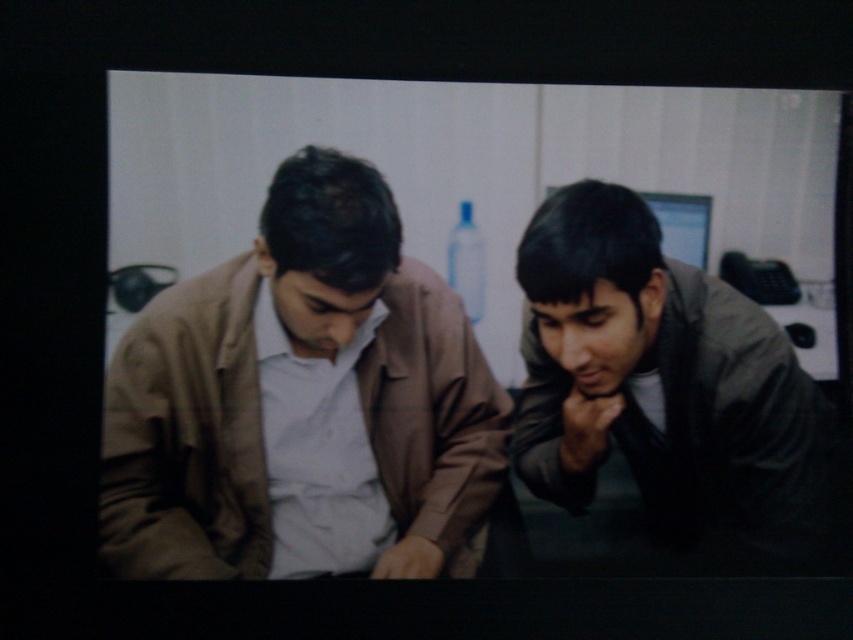
Question: Which of the following is the closest to the observer?

Choices:
 (A) (128, 502)
 (B) (810, 387)

Answer: (A)

Question: Which point is farther to the camera?

Choices:
 (A) (360, 300)
 (B) (553, 451)

Answer: (B)

Question: Is matte brown jacket at left in front of dark gray jacket at right?

Choices:
 (A) yes
 (B) no

Answer: (A)

Question: Does matte brown jacket at left have a greater width compared to dark gray jacket at right?

Choices:
 (A) no
 (B) yes

Answer: (B)

Question: Which of the following is the closest to the observer?

Choices:
 (A) (331, 483)
 (B) (804, 529)

Answer: (B)

Question: Where is matte brown jacket at left located in relation to dark gray jacket at right in the image?

Choices:
 (A) right
 (B) left

Answer: (B)